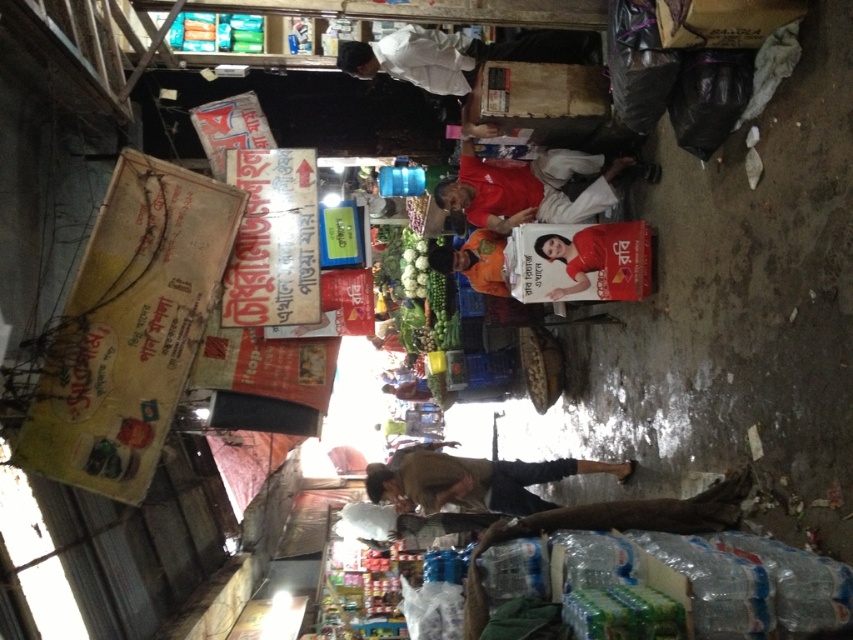
Question: Can you confirm if white cloth at upper center is positioned above smooth plastic poster at center?

Choices:
 (A) yes
 (B) no

Answer: (A)

Question: Which object appears farthest from the camera in this image?

Choices:
 (A) smooth plastic poster at center
 (B) brown cotton shirt at center
 (C) white cloth at upper center

Answer: (B)

Question: From the image, what is the correct spatial relationship of white cloth at upper center in relation to smooth plastic poster at center?

Choices:
 (A) above
 (B) below

Answer: (A)

Question: Does brown cotton shirt at center appear on the left side of white cloth at upper center?

Choices:
 (A) no
 (B) yes

Answer: (A)

Question: Which object is positioned farthest from the brown cotton shirt at center?

Choices:
 (A) smooth plastic poster at center
 (B) white cloth at upper center

Answer: (B)

Question: Which object is positioned farthest from the white cloth at upper center?

Choices:
 (A) smooth plastic poster at center
 (B) brown cotton shirt at center

Answer: (B)